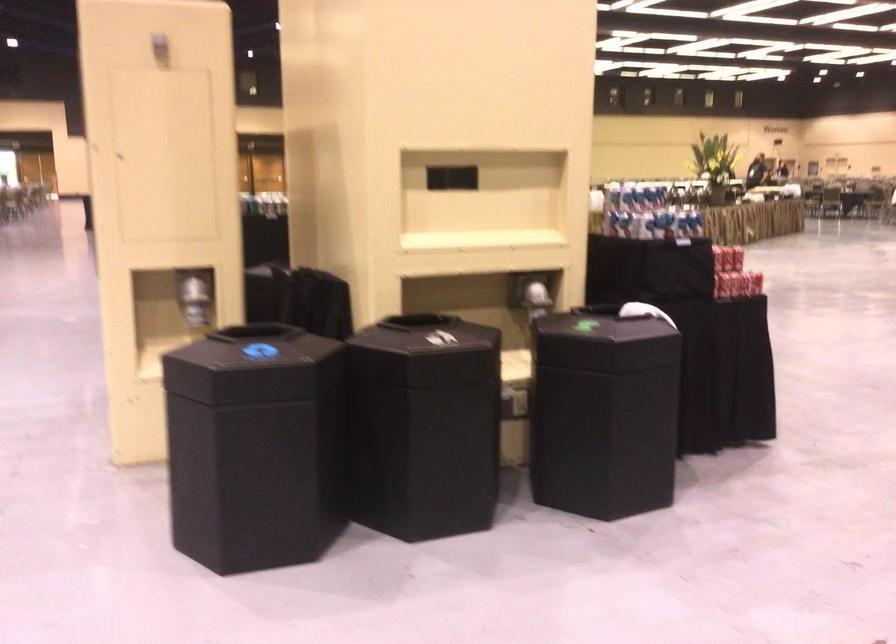
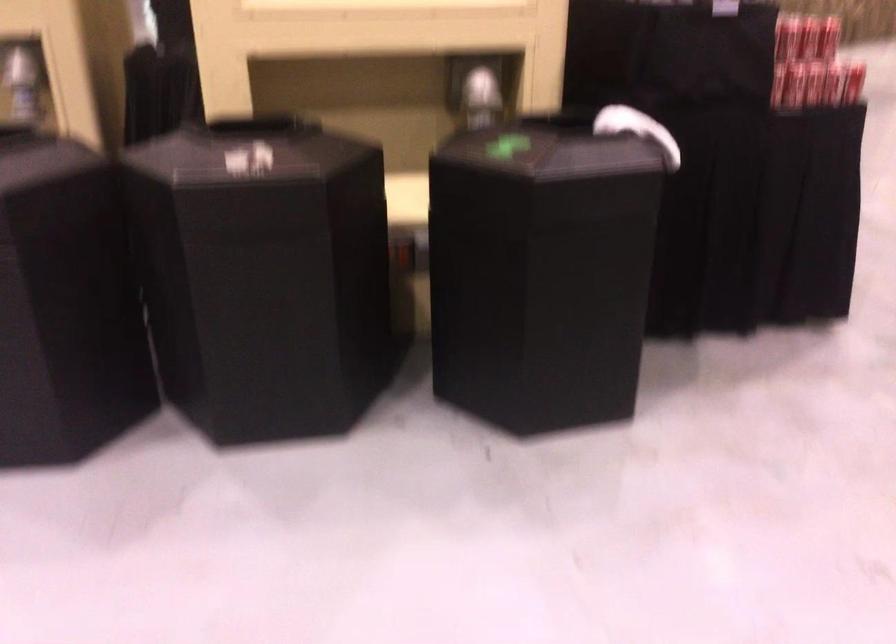
Locate, in the second image, the point that corresponds to the point at 725,256 in the first image.

(787, 37)